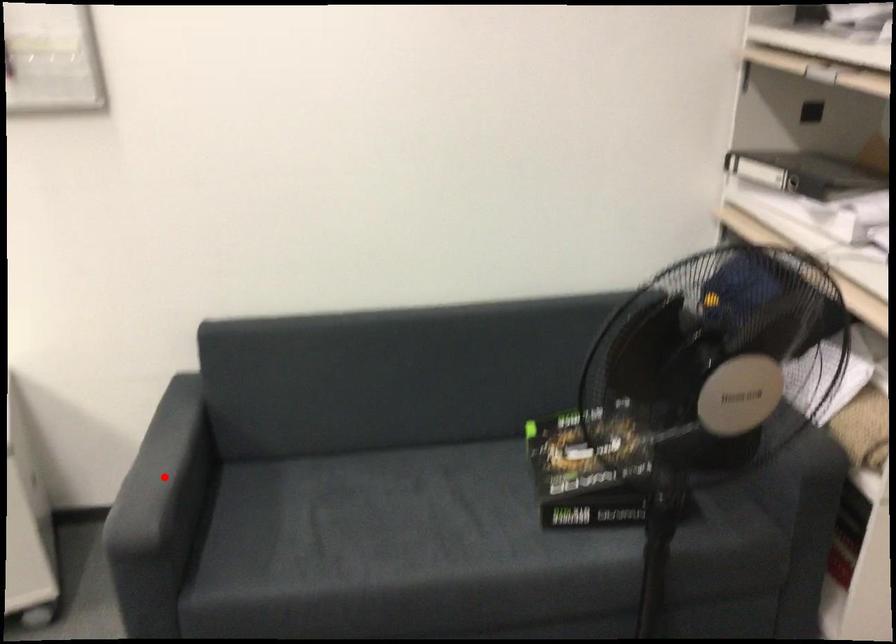
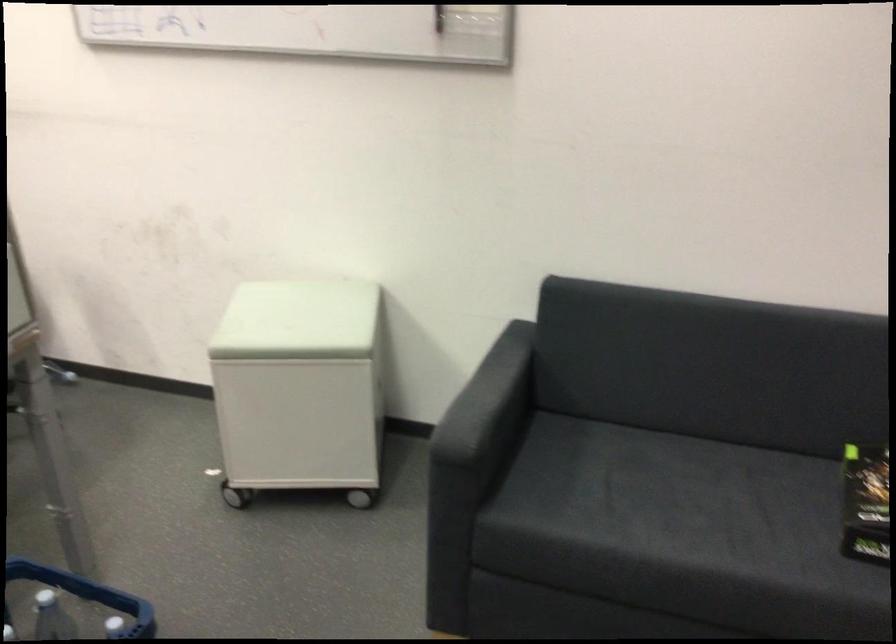
Where in the second image is the point corresponding to the highlighted location from the first image?

(487, 401)